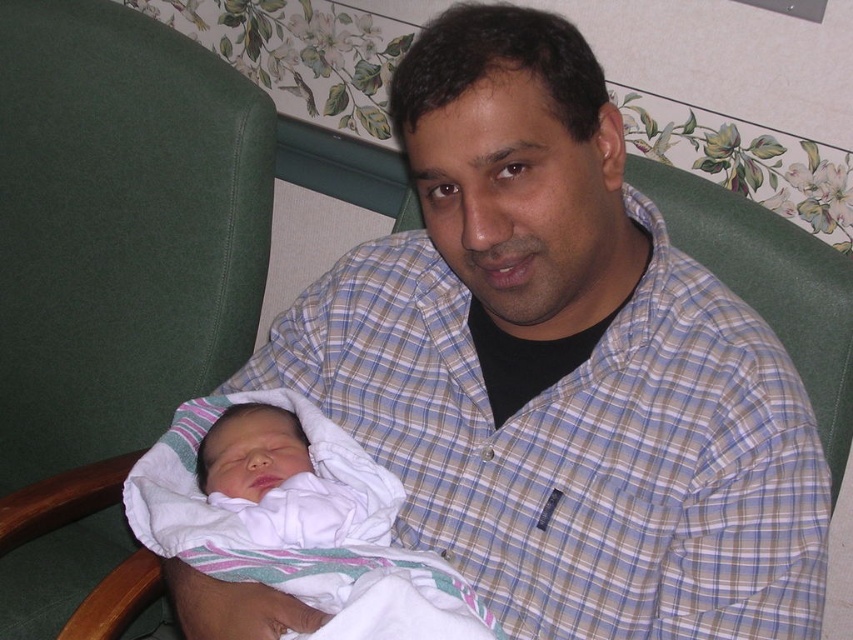
You are a furniture designer who wants to place a decorative pillow on the white soft cloth at center so that it doesn not block the view of the green fabric swivel chair at left. Can you do this?

The green fabric swivel chair at left is taller than white soft cloth at center. So placing a decorative pillow on the white soft cloth at center won not block the view of the green fabric swivel chair at left since the chair is taller.